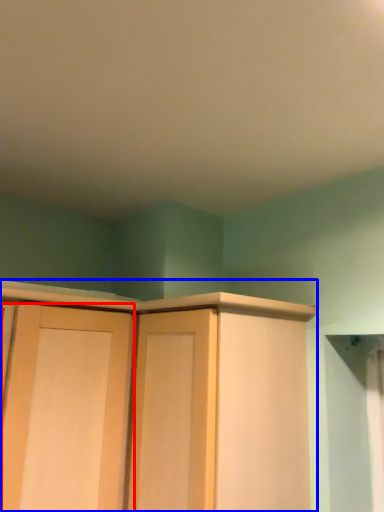
Question: Which object appears closest to the camera in this image, door (highlighted by a red box) or cupboard (highlighted by a blue box)?

Choices:
 (A) door
 (B) cupboard

Answer: (B)